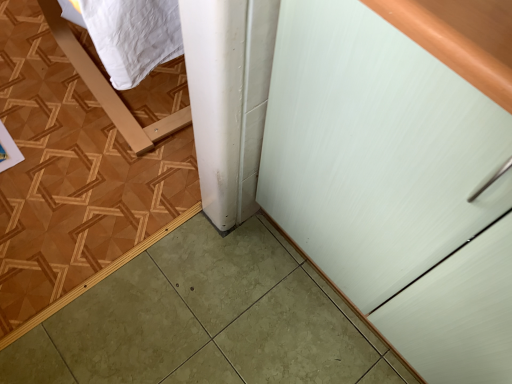
Question: Is green glossy tile at lower left wider than white matte cabinet at right?

Choices:
 (A) no
 (B) yes

Answer: (B)

Question: Considering the relative sizes of green glossy tile at lower left and white matte cabinet at right in the image provided, is green glossy tile at lower left bigger than white matte cabinet at right?

Choices:
 (A) no
 (B) yes

Answer: (A)

Question: Considering the relative sizes of green glossy tile at lower left and white matte cabinet at right in the image provided, is green glossy tile at lower left smaller than white matte cabinet at right?

Choices:
 (A) yes
 (B) no

Answer: (A)

Question: Would you say white matte cabinet at right is part of green glossy tile at lower left's contents?

Choices:
 (A) yes
 (B) no

Answer: (B)

Question: Is green glossy tile at lower left thinner than white matte cabinet at right?

Choices:
 (A) yes
 (B) no

Answer: (B)

Question: Does green glossy tile at lower left have a lesser height compared to white matte cabinet at right?

Choices:
 (A) no
 (B) yes

Answer: (B)

Question: Is white matte cabinet at right at the left side of green glossy tile at lower left?

Choices:
 (A) no
 (B) yes

Answer: (A)

Question: Considering the relative sizes of white matte cabinet at right and green glossy tile at lower left in the image provided, is white matte cabinet at right thinner than green glossy tile at lower left?

Choices:
 (A) yes
 (B) no

Answer: (A)

Question: From the image's perspective, would you say white matte cabinet at right is positioned over green glossy tile at lower left?

Choices:
 (A) no
 (B) yes

Answer: (A)

Question: Is white matte cabinet at right not near green glossy tile at lower left?

Choices:
 (A) no
 (B) yes

Answer: (A)

Question: Is white matte cabinet at right directly adjacent to green glossy tile at lower left?

Choices:
 (A) no
 (B) yes

Answer: (A)

Question: Does white matte cabinet at right have a larger size compared to green glossy tile at lower left?

Choices:
 (A) no
 (B) yes

Answer: (B)

Question: Is green glossy tile at lower left inside the boundaries of white matte cabinet at right, or outside?

Choices:
 (A) outside
 (B) inside

Answer: (A)